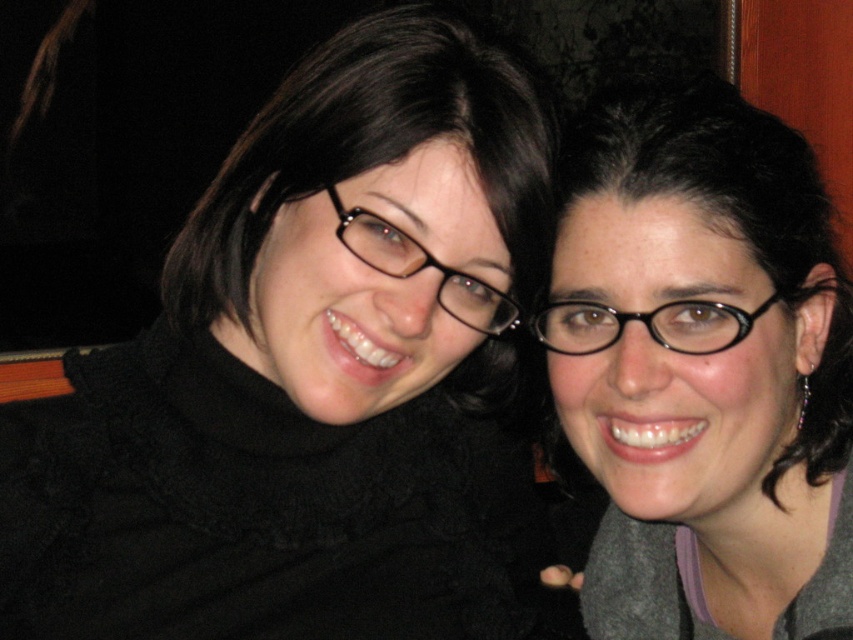
You are a photographer trying to adjust the lighting for a portrait. You notice two pairs of glasses at the center of the image. Which pair of glasses is closer to you, the photographer, between the black matte glasses at center and the black plastic glasses at center?

The black matte glasses at center is closer to you because it is positioned further to the viewer than the black plastic glasses at center.

You are a photographer adjusting the lighting for a portrait. You notice a point at coordinates (x=703, y=369) in the image. What object is located at this point?

The point at coordinates (x=703, y=369) indicates the location of the black matte glasses at center.

You are a photographer trying to adjust the lighting for a portrait. You notice the matte black sweater at upper left and the black plastic glasses at center. Which object is closer to the camera based on their positions?

The black plastic glasses at center is behind the matte black sweater at upper left, so the matte black sweater at upper left is closer to the camera.